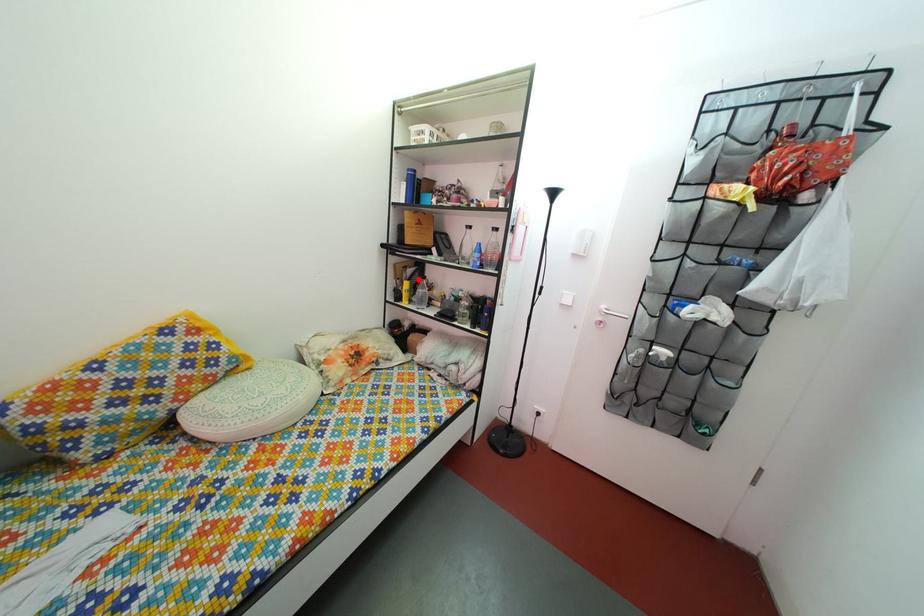
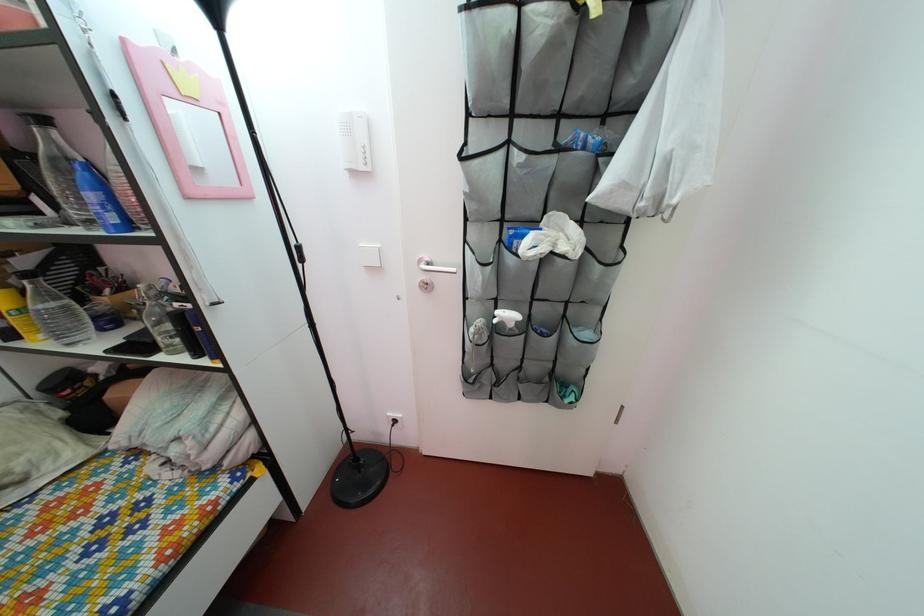
Question: I am providing you with two images of the same scene from different viewpoints. A red point is shown in image1. For the corresponding object point in image2, is it positioned nearer or farther from the camera?

Choices:
 (A) Nearer
 (B) Farther

Answer: (B)